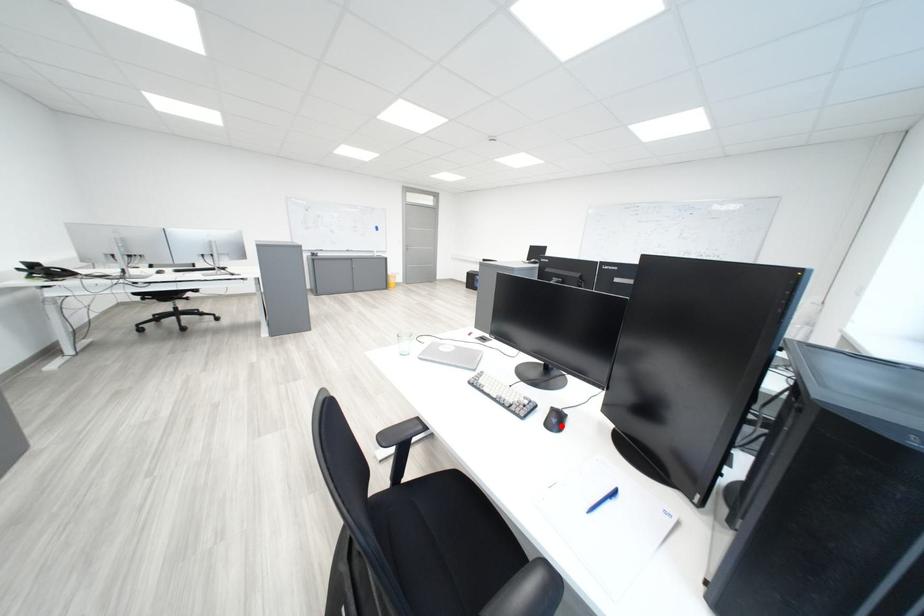
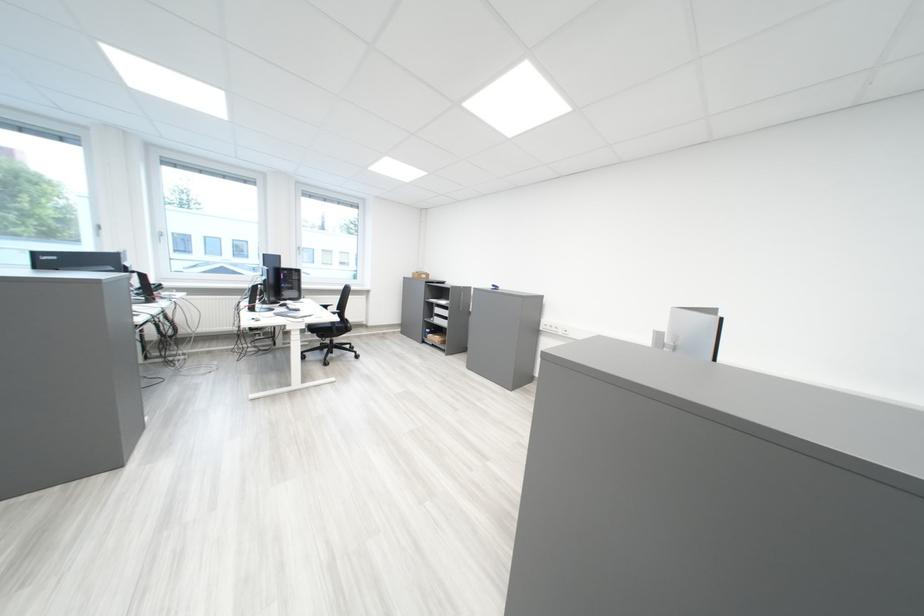
Question: I am providing you with two images of the same scene from different viewpoints. A red point is marked on the first image. At the location where the point appears in image 1, is it still visible in image 2?

Choices:
 (A) Yes
 (B) No

Answer: (B)